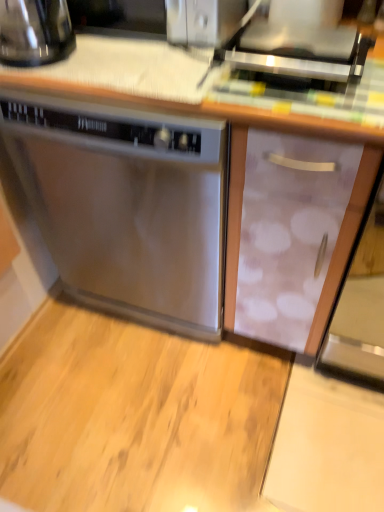
Question: Is satin silver toaster at upper center taller than stainless steel dishwasher at center?

Choices:
 (A) no
 (B) yes

Answer: (A)

Question: Considering the relative sizes of satin silver toaster at upper center and stainless steel dishwasher at center in the image provided, is satin silver toaster at upper center shorter than stainless steel dishwasher at center?

Choices:
 (A) no
 (B) yes

Answer: (B)

Question: Does satin silver toaster at upper center have a greater width compared to stainless steel dishwasher at center?

Choices:
 (A) yes
 (B) no

Answer: (B)

Question: Considering the relative positions of satin silver toaster at upper center and stainless steel dishwasher at center in the image provided, is satin silver toaster at upper center in front of stainless steel dishwasher at center?

Choices:
 (A) yes
 (B) no

Answer: (A)

Question: Is satin silver toaster at upper center positioned with its back to stainless steel dishwasher at center?

Choices:
 (A) no
 (B) yes

Answer: (A)

Question: Is stainless steel dishwasher at center taller or shorter than satin silver toaster at upper center?

Choices:
 (A) short
 (B) tall

Answer: (B)

Question: From the image's perspective, is stainless steel dishwasher at center positioned above or below satin silver toaster at upper center?

Choices:
 (A) below
 (B) above

Answer: (A)

Question: Is stainless steel dishwasher at center inside or outside of satin silver toaster at upper center?

Choices:
 (A) inside
 (B) outside

Answer: (B)

Question: Based on their sizes in the image, would you say stainless steel dishwasher at center is bigger or smaller than satin silver toaster at upper center?

Choices:
 (A) small
 (B) big

Answer: (B)

Question: Is shiny black kettle at upper left taller or shorter than satin silver toaster at upper center?

Choices:
 (A) tall
 (B) short

Answer: (A)

Question: Is point (46, 19) closer or farther from the camera than point (294, 53)?

Choices:
 (A) farther
 (B) closer

Answer: (A)

Question: In terms of size, does shiny black kettle at upper left appear bigger or smaller than satin silver toaster at upper center?

Choices:
 (A) big
 (B) small

Answer: (A)

Question: Visually, is shiny black kettle at upper left positioned to the left or to the right of satin silver toaster at upper center?

Choices:
 (A) right
 (B) left

Answer: (B)

Question: In terms of size, does shiny black kettle at upper left appear bigger or smaller than stainless steel dishwasher at center?

Choices:
 (A) small
 (B) big

Answer: (A)

Question: From a real-world perspective, is shiny black kettle at upper left positioned above or below stainless steel dishwasher at center?

Choices:
 (A) below
 (B) above

Answer: (B)